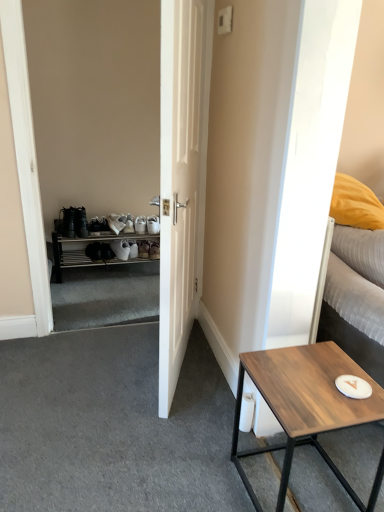
You are a GUI agent. You are given a task and a screenshot of the screen. Output one action in this format:
    pyautogui.click(x=<x>, y=<y>)
    Task: Click on the free space above wooden table at lower right (from a real-world perspective)
    This screenshot has height=512, width=384.
    Given the screenshot: What is the action you would take?
    [x=313, y=380]